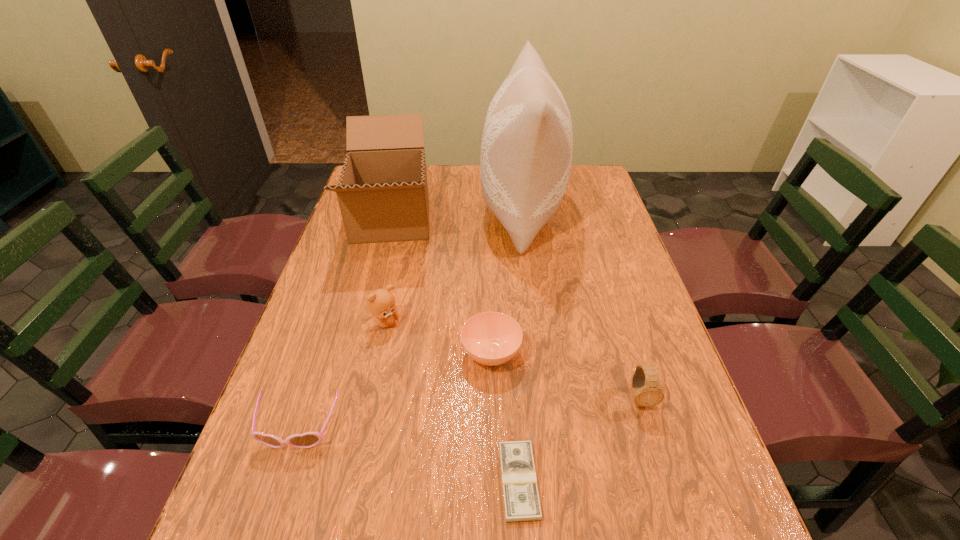
Locate an element on the screen. The width and height of the screenshot is (960, 540). free spot that satisfies the following two spatial constraints: 1. on the face of the teddy bear; 2. on the front-facing side of the sunglasses is located at coordinates (363, 428).

In order to click on free spot that satisfies the following two spatial constraints: 1. on the face of the teddy bear; 2. on the front-facing side of the sunglasses in this screenshot , I will do pos(363,428).